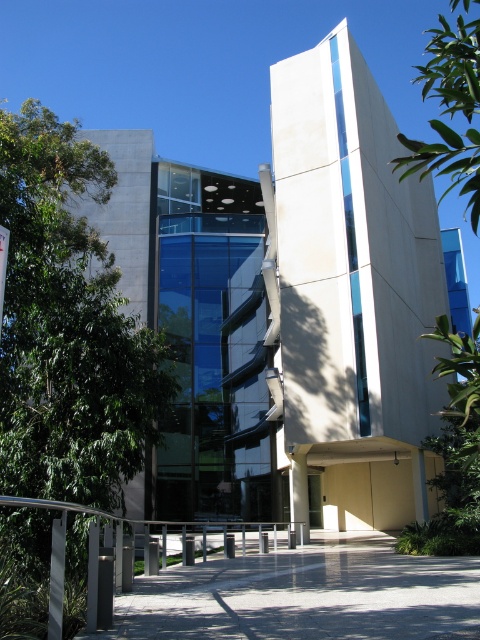
You are a maintenance worker needing to inspect the green leafy tree at upper right from your current position near the silver metallic railing at lower center. Given that you walk at a speed of 1.5 meters per second, how many seconds will it take you to reach the tree?

The distance between the silver metallic railing at lower center and the green leafy tree at upper right is 28.26 meters. At a walking speed of 1.5 meters per second, it will take approximately 18.84 seconds to reach the tree.

You are a landscape architect designing a pathway from the concrete at center to the green leafy tree at upper right. What is the minimum length of the pathway required to connect them directly?

The minimum length of the pathway required to connect the concrete at center and the green leafy tree at upper right directly is 19.83 meters.